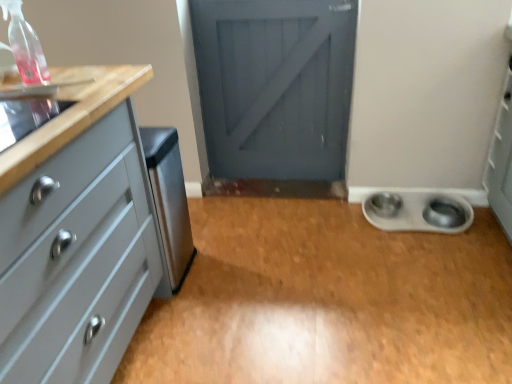
Find the location of `free space on the front side of clear plastic spray bottle at upper left`. free space on the front side of clear plastic spray bottle at upper left is located at coordinates (37, 100).